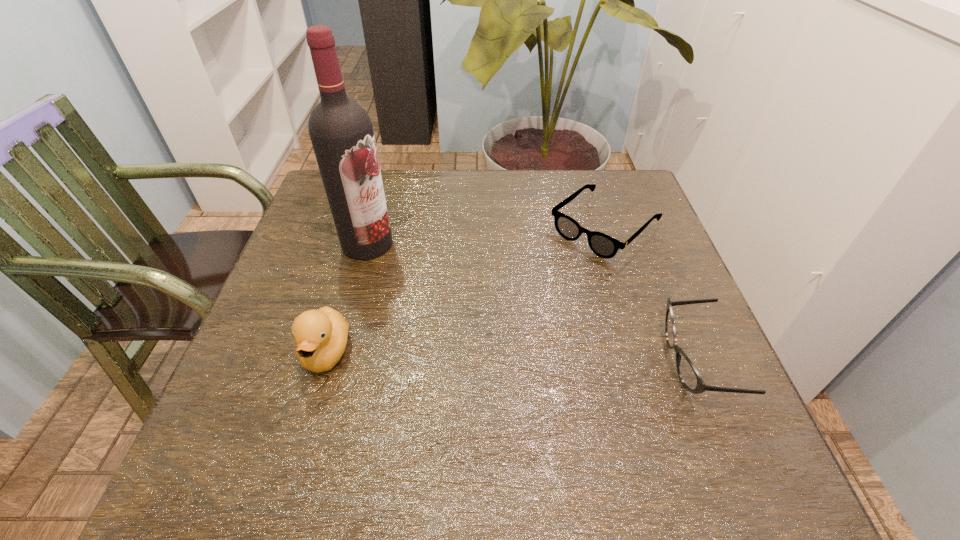
Find the location of a particular element. The image size is (960, 540). free space that is in between the tallest object and the second tallest object is located at coordinates (348, 298).

Locate an element on the screen. vacant space that's between the duckling and the farther spectacles is located at coordinates (466, 290).

The width and height of the screenshot is (960, 540). Find the location of `free space between the tallest object and the nearer spectacles`. free space between the tallest object and the nearer spectacles is located at coordinates (532, 302).

At what (x,y) coordinates should I click in order to perform the action: click on blank region between the farther spectacles and the tallest object. Please return your answer as a coordinate pair (x, y). Looking at the image, I should click on (486, 236).

You are a GUI agent. You are given a task and a screenshot of the screen. Output one action in this format:
    pyautogui.click(x=<x>, y=<y>)
    Task: Click on the vacant space that's between the second tallest object and the nearer spectacles
    This screenshot has width=960, height=540.
    Given the screenshot: What is the action you would take?
    pyautogui.click(x=512, y=357)

Find the location of a particular element. This screenshot has width=960, height=540. object that is the second closest to the wine bottle is located at coordinates (x=603, y=245).

Point out which object is positioned as the second nearest to the farther spectacles. Please provide its 2D coordinates. Your answer should be formatted as a tuple, i.e. [(x, y)], where the tuple contains the x and y coordinates of a point satisfying the conditions above.

[(341, 132)]

Locate an element on the screen. blank area in the image that satisfies the following two spatial constraints: 1. facing forward on the nearer spectacles; 2. on the front-facing side of the second tallest object is located at coordinates (324, 361).

This screenshot has height=540, width=960. I want to click on free location that satisfies the following two spatial constraints: 1. facing forward on the second tallest object; 2. on the front-facing side of the nearer spectacles, so click(x=324, y=361).

This screenshot has height=540, width=960. I want to click on vacant space that satisfies the following two spatial constraints: 1. on the front side of the nearer spectacles; 2. on the front-facing side of the farther spectacles, so click(x=646, y=361).